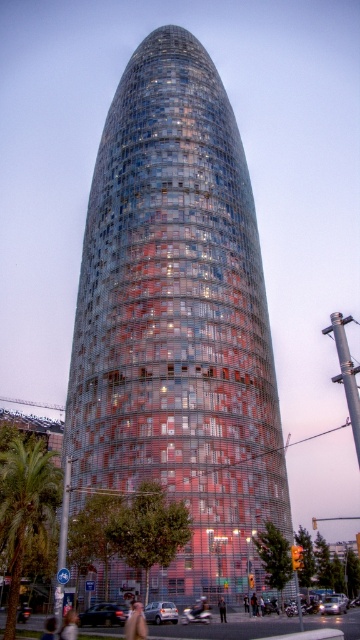
Is glassy steel tower at center behind dark gray suit at center?

No.

Is glassy steel tower at center to the left of dark gray suit at center from the viewer's perspective?

Indeed, glassy steel tower at center is positioned on the left side of dark gray suit at center.

Who is more forward, (177,368) or (223,618)?

Positioned in front is point (223,618).

I want to click on glassy steel tower at center, so click(x=177, y=321).

Between point (109, 170) and point (20, 481), which one is positioned in front?

Positioned in front is point (20, 481).

Is glassy steel tower at center taller than green leafy palm tree at lower left?

Yes.

You are a GUI agent. You are given a task and a screenshot of the screen. Output one action in this format:
    pyautogui.click(x=<x>, y=<y>)
    Task: Click on the glassy steel tower at center
    
    Given the screenshot: What is the action you would take?
    tap(177, 321)

Identify the location of glassy steel tower at center. This screenshot has height=640, width=360. (177, 321).

Can you confirm if green leafy palm tree at lower left is thinner than dark gray suit at center?

No, green leafy palm tree at lower left is not thinner than dark gray suit at center.

Is point (25, 557) positioned behind point (221, 605)?

Yes.

Locate an element on the screen. Image resolution: width=360 pixels, height=640 pixels. green leafy palm tree at lower left is located at coordinates (24, 509).